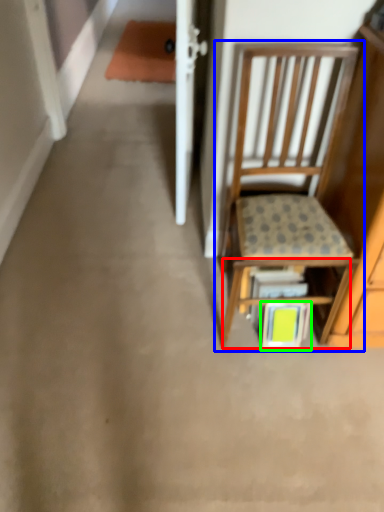
Question: Considering the real-world distances, which object is closest to shelf (highlighted by a red box)? chair (highlighted by a blue box) or book (highlighted by a green box).

Choices:
 (A) chair
 (B) book

Answer: (B)